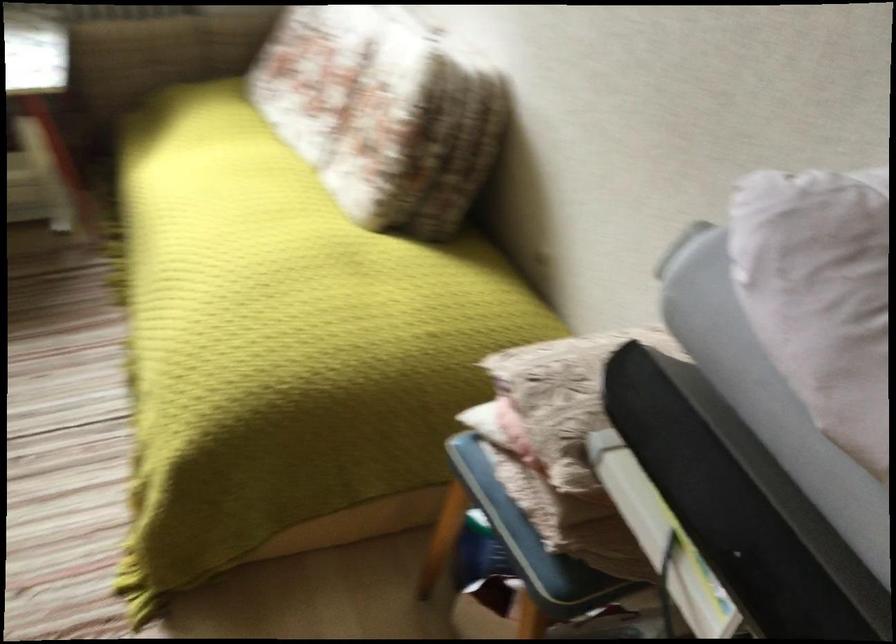
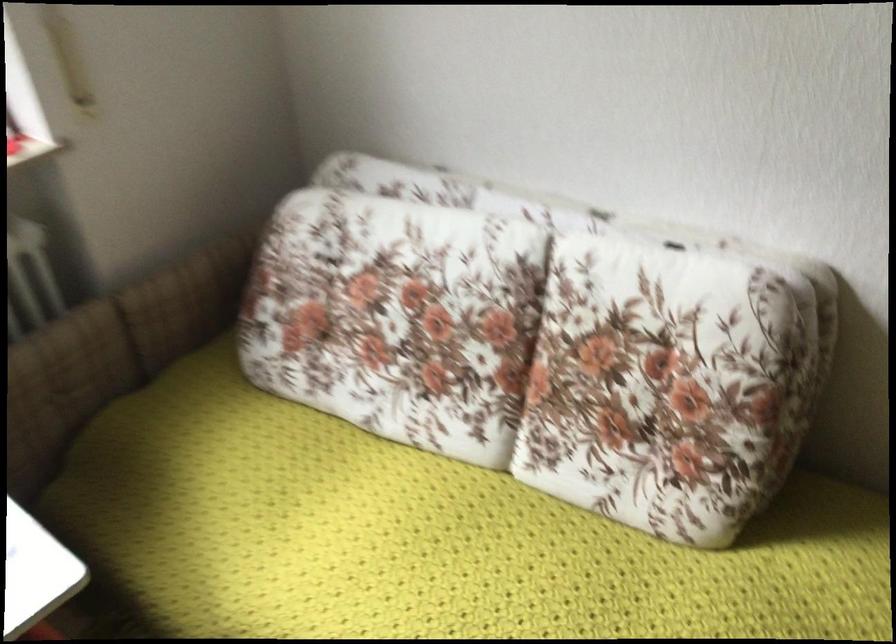
Locate, in the second image, the point that corresponds to point (231, 174) in the first image.

(429, 538)